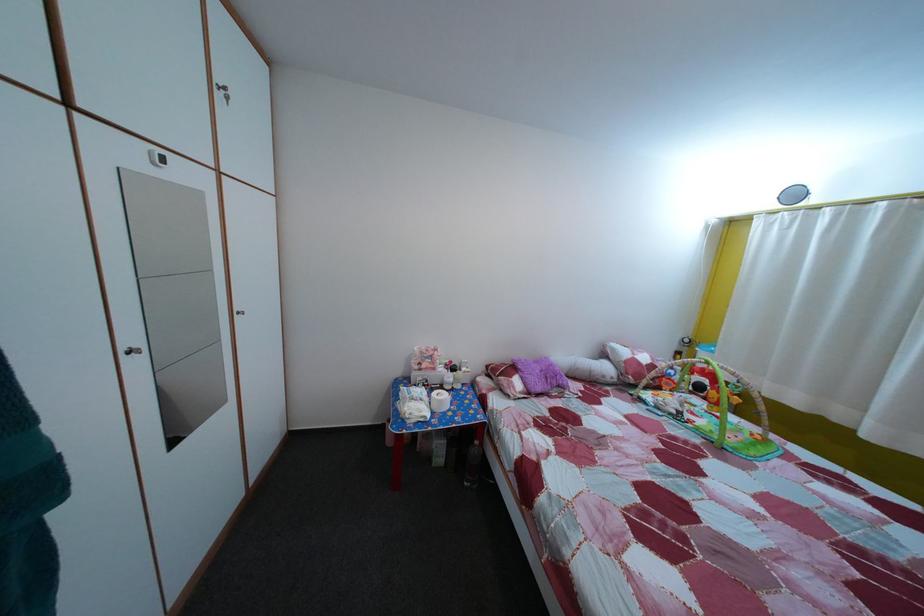
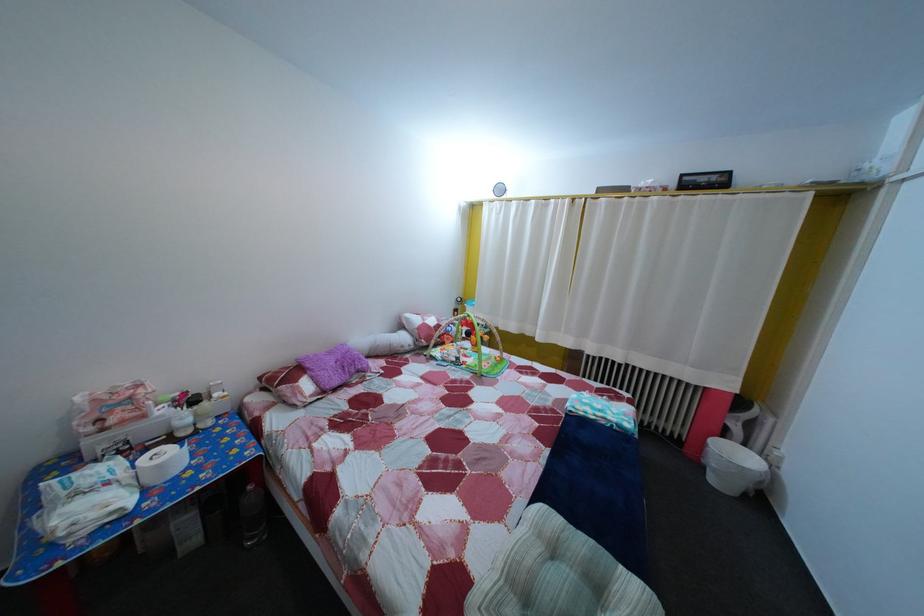
Question: The camera is either moving clockwise (left) or counter-clockwise (right) around the object. The first image is from the beginning of the video and the second image is from the end. Is the camera moving left or right when shooting the video?

Choices:
 (A) Left
 (B) Right

Answer: (A)